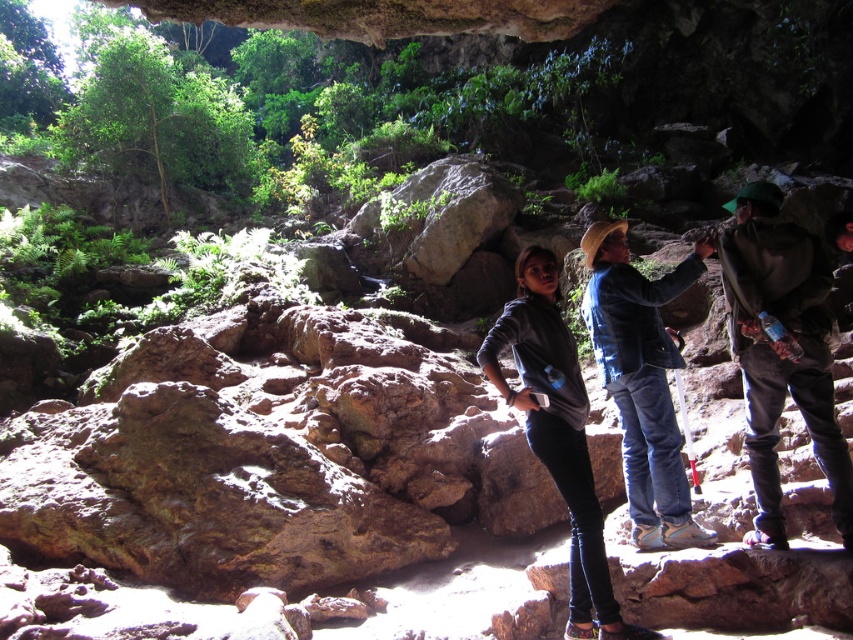
Question: Can you confirm if dark blue jeans at center is positioned to the right of blue denim jeans at center?

Choices:
 (A) yes
 (B) no

Answer: (A)

Question: Among these points, which one is nearest to the camera?

Choices:
 (A) (575, 552)
 (B) (776, 294)
 (C) (596, 314)

Answer: (A)

Question: Which point is farther to the camera?

Choices:
 (A) dark brown leather jacket at right
 (B) blue denim jeans at center
 (C) dark blue jeans at center
 (D) gray matte jacket at center

Answer: (B)

Question: Which object appears closest to the camera in this image?

Choices:
 (A) dark brown leather jacket at right
 (B) blue denim jeans at center
 (C) dark blue jeans at center

Answer: (C)

Question: Can you confirm if dark brown leather jacket at right is positioned to the left of blue denim jeans at center?

Choices:
 (A) no
 (B) yes

Answer: (A)

Question: Is dark brown leather jacket at right wider than gray matte jacket at center?

Choices:
 (A) no
 (B) yes

Answer: (A)